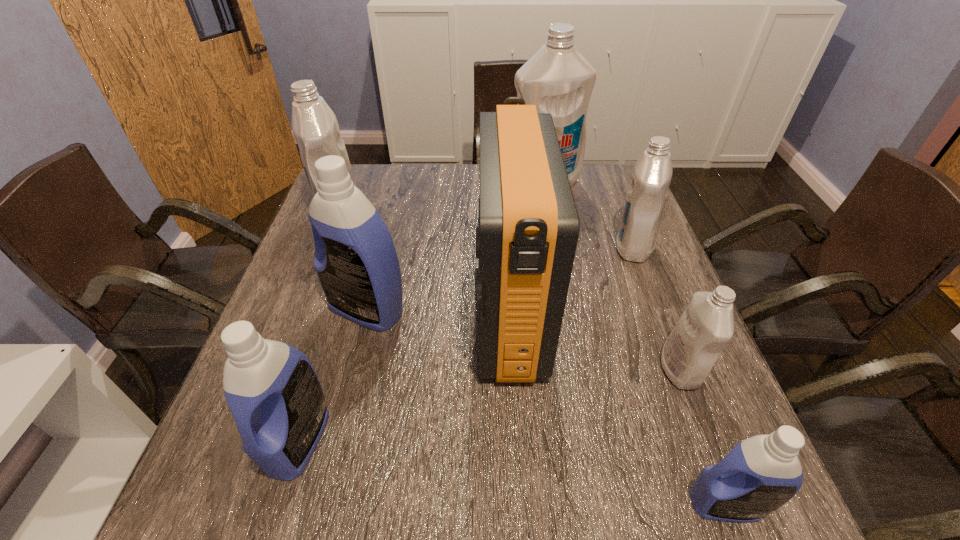
Locate which detergent ranks in proximity to the third biggest white detergent. Please provide its 2D coordinates. Your answer should be formatted as a tuple, i.e. [(x, y)], where the tuple contains the x and y coordinates of a point satisfying the conditions above.

[(557, 79)]

Identify which detergent is the fourth closest to the third white detergent from right to left. Please provide its 2D coordinates. Your answer should be formatted as a tuple, i.e. [(x, y)], where the tuple contains the x and y coordinates of a point satisfying the conditions above.

[(706, 326)]

Select which white detergent appears as the closest to the third white detergent from right to left. Please provide its 2D coordinates. Your answer should be formatted as a tuple, i.e. [(x, y)], where the tuple contains the x and y coordinates of a point satisfying the conditions above.

[(647, 194)]

The height and width of the screenshot is (540, 960). Find the location of `white detergent that is the fourth closest to the rightmost blue detergent`. white detergent that is the fourth closest to the rightmost blue detergent is located at coordinates (315, 127).

Where is `blue detergent that can be found as the third closest to the second smallest white detergent`? The width and height of the screenshot is (960, 540). blue detergent that can be found as the third closest to the second smallest white detergent is located at coordinates (274, 394).

Identify which blue detergent is the third closest to the tallest detergent. Please provide its 2D coordinates. Your answer should be formatted as a tuple, i.e. [(x, y)], where the tuple contains the x and y coordinates of a point satisfying the conditions above.

[(760, 474)]

Locate an element on the screen. The image size is (960, 540). blank area in the image that satisfies the following two spatial constraints: 1. on the front-facing side of the radio receiver; 2. on the right side of the rightmost blue detergent is located at coordinates (520, 504).

Where is `free space that satisfies the following two spatial constraints: 1. on the front-facing side of the third nearest detergent; 2. on the right side of the radio receiver`? The width and height of the screenshot is (960, 540). free space that satisfies the following two spatial constraints: 1. on the front-facing side of the third nearest detergent; 2. on the right side of the radio receiver is located at coordinates (x=512, y=369).

The width and height of the screenshot is (960, 540). I want to click on free region that satisfies the following two spatial constraints: 1. on the front side of the second smallest white detergent; 2. on the front-facing side of the radio receiver, so click(x=660, y=315).

Locate an element on the screen. The width and height of the screenshot is (960, 540). free region that satisfies the following two spatial constraints: 1. on the back side of the third nearest detergent; 2. on the right side of the second smallest blue detergent is located at coordinates (321, 369).